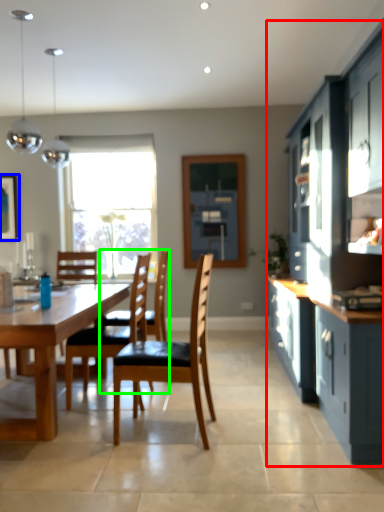
Question: Which object is the closest to the cabinetry (highlighted by a red box)? Choose among these: picture frame (highlighted by a blue box) or chair (highlighted by a green box).

Choices:
 (A) picture frame
 (B) chair

Answer: (B)